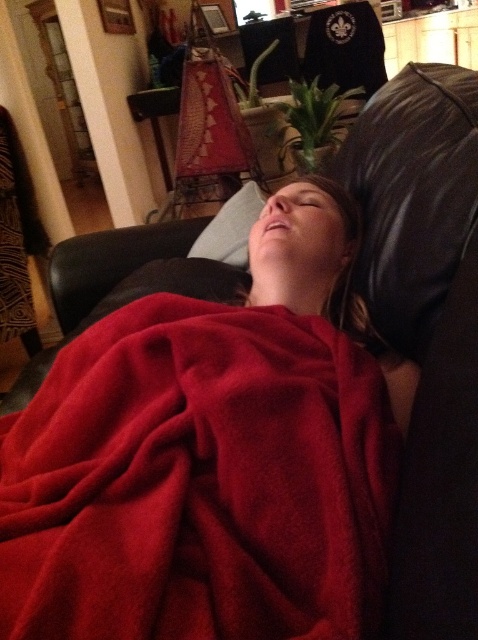
Question: Which point is farther to the camera?

Choices:
 (A) red fleece blanket at lower left
 (B) velvety red robe at lower left
 (C) gray fabric pillow at center

Answer: (B)

Question: Is red fleece blanket at lower left positioned before gray fabric pillow at center?

Choices:
 (A) no
 (B) yes

Answer: (B)

Question: Which object is positioned closest to the velvety red robe at lower left?

Choices:
 (A) red fleece blanket at lower left
 (B) gray fabric pillow at center

Answer: (B)

Question: Does red fleece blanket at lower left have a lesser width compared to gray fabric pillow at center?

Choices:
 (A) yes
 (B) no

Answer: (B)

Question: Which object is the closest to the gray fabric pillow at center?

Choices:
 (A) red fleece blanket at lower left
 (B) velvety red robe at lower left

Answer: (A)

Question: Is red fleece blanket at lower left smaller than gray fabric pillow at center?

Choices:
 (A) no
 (B) yes

Answer: (A)